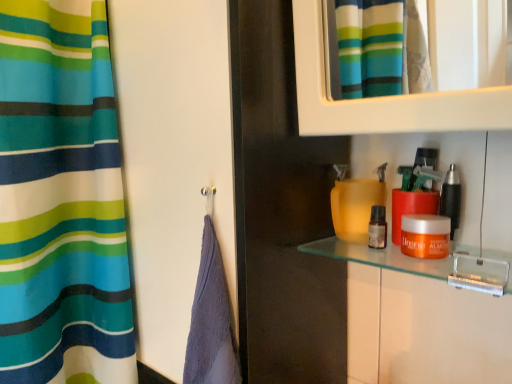
Question: From the image's perspective, would you say orange matte jar at right, which appears as the second cosmetic when viewed from the right, is shown under metallic black razor at right, the 3th cosmetic in the left-to-right sequence?

Choices:
 (A) no
 (B) yes

Answer: (B)

Question: Is orange matte jar at right, which appears as the second cosmetic when viewed from the right, taller than metallic black razor at right, the first cosmetic viewed from the right?

Choices:
 (A) yes
 (B) no

Answer: (B)

Question: Considering the relative sizes of orange matte jar at right, which ranks as the 2th cosmetic in left-to-right order, and metallic black razor at right, the 3th cosmetic in the left-to-right sequence, in the image provided, is orange matte jar at right, which ranks as the 2th cosmetic in left-to-right order, wider than metallic black razor at right, the 3th cosmetic in the left-to-right sequence,?

Choices:
 (A) yes
 (B) no

Answer: (A)

Question: Is orange matte jar at right, which appears as the second cosmetic when viewed from the right, positioned with its back to metallic black razor at right, the 3th cosmetic in the left-to-right sequence?

Choices:
 (A) yes
 (B) no

Answer: (A)

Question: Is orange matte jar at right, which ranks as the 2th cosmetic in left-to-right order, next to metallic black razor at right, the 3th cosmetic in the left-to-right sequence?

Choices:
 (A) no
 (B) yes

Answer: (B)

Question: From a real-world perspective, is orange matte jar at right, which appears as the second cosmetic when viewed from the right, positioned under metallic black razor at right, the first cosmetic viewed from the right, based on gravity?

Choices:
 (A) yes
 (B) no

Answer: (A)

Question: From a real-world perspective, is transparent glass screen door at center under metallic black razor at right, the 3th cosmetic in the left-to-right sequence?

Choices:
 (A) yes
 (B) no

Answer: (A)

Question: Considering the relative sizes of transparent glass screen door at center and metallic black razor at right, the first cosmetic viewed from the right, in the image provided, is transparent glass screen door at center wider than metallic black razor at right, the first cosmetic viewed from the right,?

Choices:
 (A) no
 (B) yes

Answer: (B)

Question: Can you see transparent glass screen door at center touching metallic black razor at right, the 3th cosmetic in the left-to-right sequence?

Choices:
 (A) no
 (B) yes

Answer: (A)

Question: Are transparent glass screen door at center and metallic black razor at right, the 3th cosmetic in the left-to-right sequence, far apart?

Choices:
 (A) yes
 (B) no

Answer: (B)

Question: Is metallic black razor at right, the first cosmetic viewed from the right, surrounded by transparent glass screen door at center?

Choices:
 (A) no
 (B) yes

Answer: (A)

Question: Is transparent glass screen door at center turned away from metallic black razor at right, the 3th cosmetic in the left-to-right sequence?

Choices:
 (A) no
 (B) yes

Answer: (A)

Question: From a real-world perspective, is translucent glass shelf at center positioned under orange matte jar at right, which ranks as the 2th cosmetic in left-to-right order, based on gravity?

Choices:
 (A) yes
 (B) no

Answer: (A)